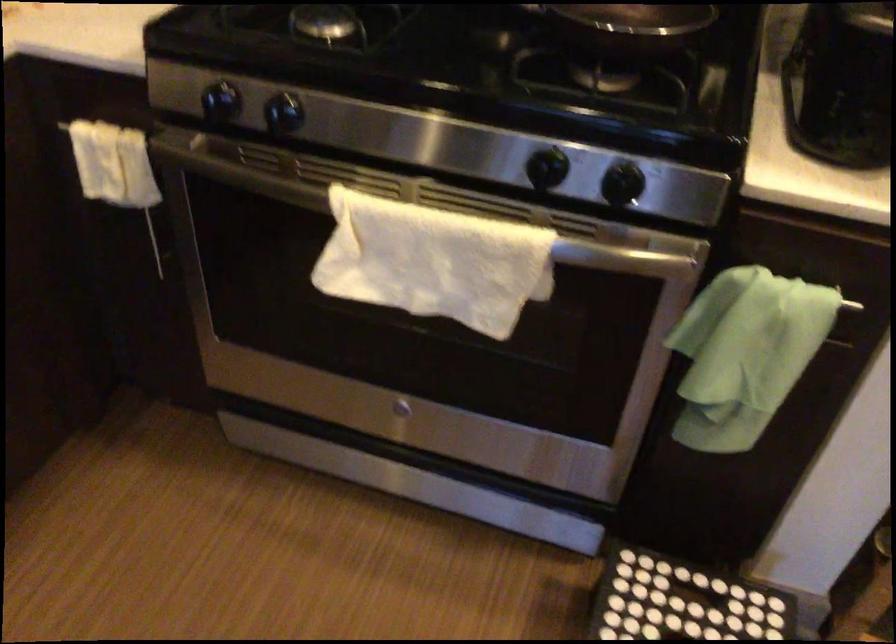
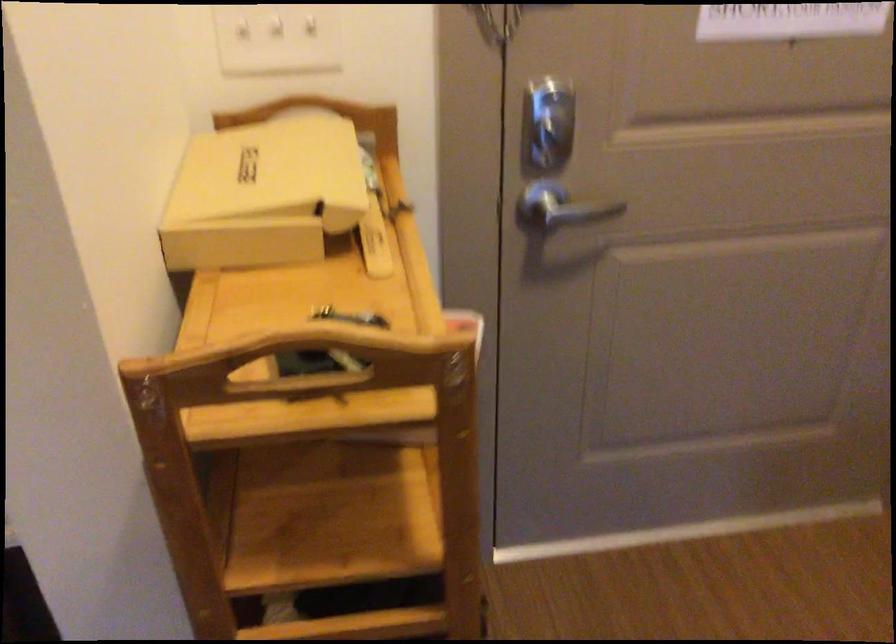
Question: In a continuous first-person perspective shot, in which direction is the camera moving?

Choices:
 (A) Left
 (B) Right
 (C) Forward
 (D) Backward

Answer: (B)